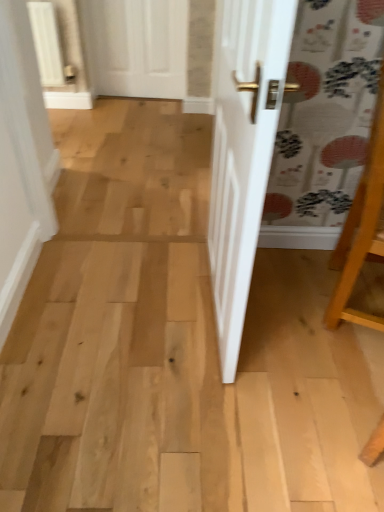
Question: Considering the positions of white matte door at upper center and wooden easel at right in the image, is white matte door at upper center bigger or smaller than wooden easel at right?

Choices:
 (A) small
 (B) big

Answer: (A)

Question: From the image's perspective, is white matte door at upper center positioned above or below wooden easel at right?

Choices:
 (A) below
 (B) above

Answer: (B)

Question: From a real-world perspective, relative to wooden easel at right, is white matte door at upper center vertically above or below?

Choices:
 (A) above
 (B) below

Answer: (B)

Question: Is wooden easel at right bigger or smaller than white matte door at upper center?

Choices:
 (A) big
 (B) small

Answer: (A)

Question: From the image's perspective, is wooden easel at right positioned above or below white matte door at upper center?

Choices:
 (A) below
 (B) above

Answer: (A)

Question: Considering the positions of wooden easel at right and white matte door at upper center in the image, is wooden easel at right taller or shorter than white matte door at upper center?

Choices:
 (A) short
 (B) tall

Answer: (B)

Question: Considering the positions of point (380, 133) and point (155, 9), is point (380, 133) closer or farther from the camera than point (155, 9)?

Choices:
 (A) farther
 (B) closer

Answer: (B)